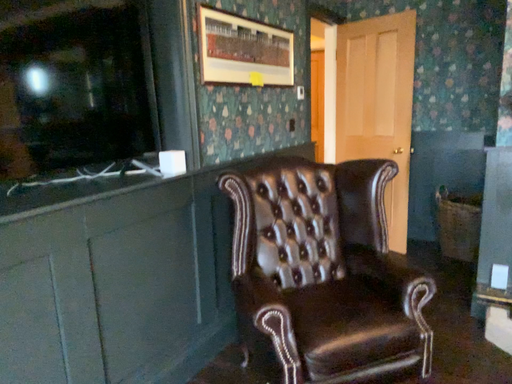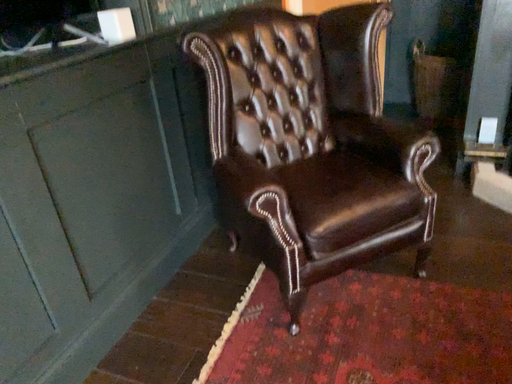
Question: Which way did the camera rotate in the video?

Choices:
 (A) rotated right
 (B) rotated left

Answer: (A)